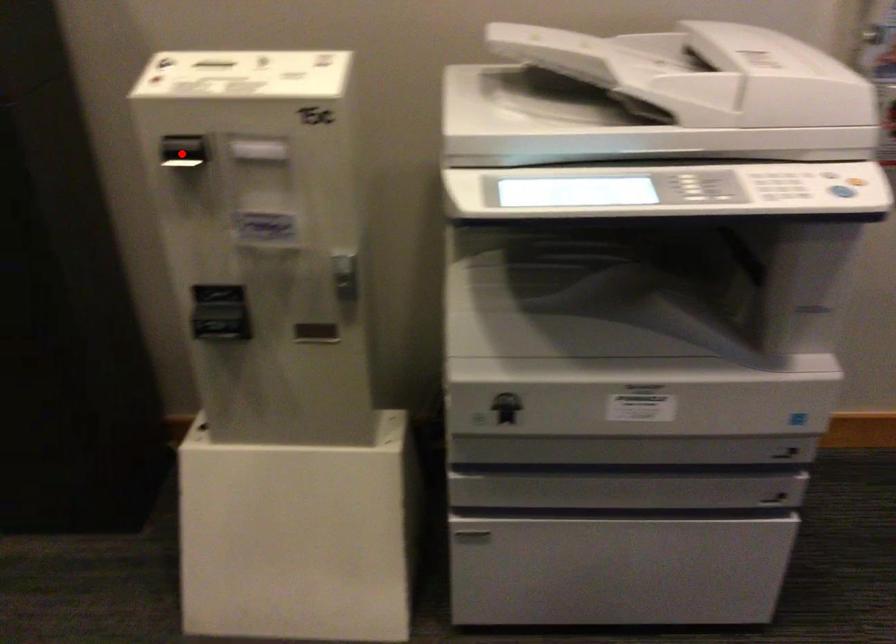
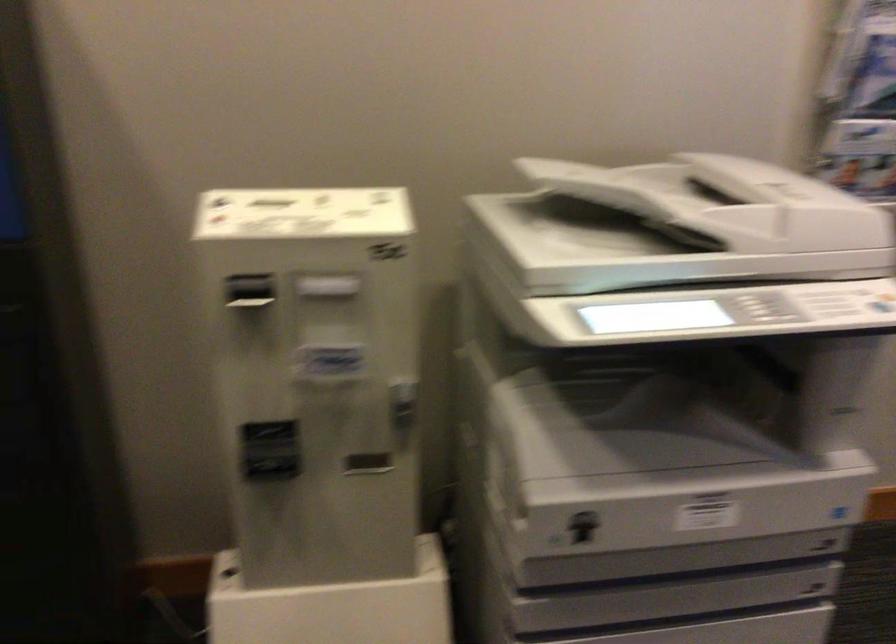
The point at the highlighted location is marked in the first image. Where is the corresponding point in the second image?

(250, 292)